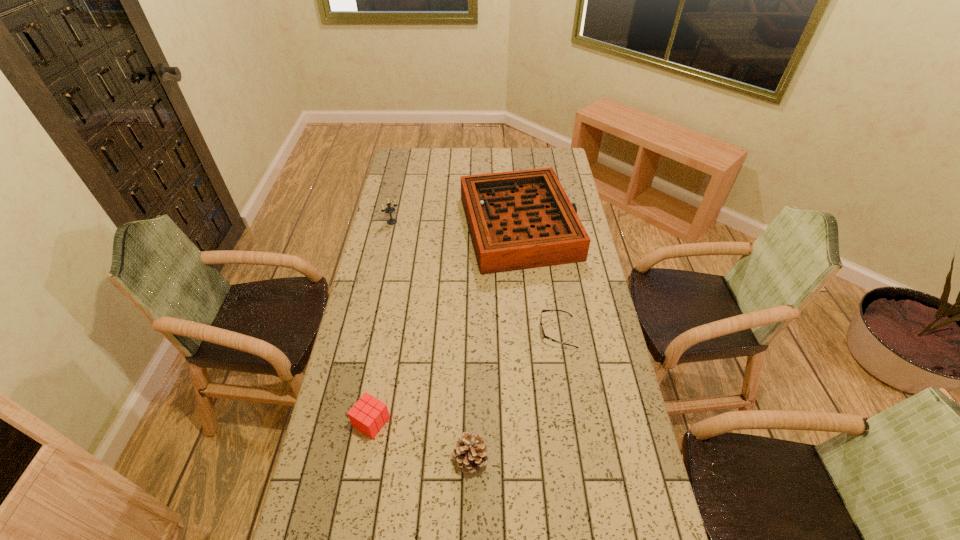
Identify the location of vacant area situated 0.140m on the right of the fourth tallest object. tap(436, 422).

I want to click on vacant space located on the front-facing side of the sunglasses, so click(x=503, y=332).

Locate an element on the screen. Image resolution: width=960 pixels, height=540 pixels. free spot located 0.390m on the front-facing side of the sunglasses is located at coordinates (430, 332).

Where is `vacant space located 0.160m on the front-facing side of the sunglasses`? vacant space located 0.160m on the front-facing side of the sunglasses is located at coordinates (494, 332).

This screenshot has width=960, height=540. In order to click on candle holder positioned at the left edge in this screenshot , I will do `click(388, 210)`.

This screenshot has height=540, width=960. What are the coordinates of `cube at the left edge` in the screenshot? It's located at (368, 415).

At what (x,y) coordinates should I click in order to perform the action: click on gameboard situated at the right edge. Please return your answer as a coordinate pair (x, y). The image size is (960, 540). Looking at the image, I should click on (523, 219).

Locate an element on the screen. The width and height of the screenshot is (960, 540). sunglasses located at the right edge is located at coordinates (543, 335).

The height and width of the screenshot is (540, 960). I want to click on free region at the far edge, so click(x=501, y=150).

This screenshot has height=540, width=960. In the image, there is a desktop. Find the location of `blank space at the left edge`. blank space at the left edge is located at coordinates (331, 458).